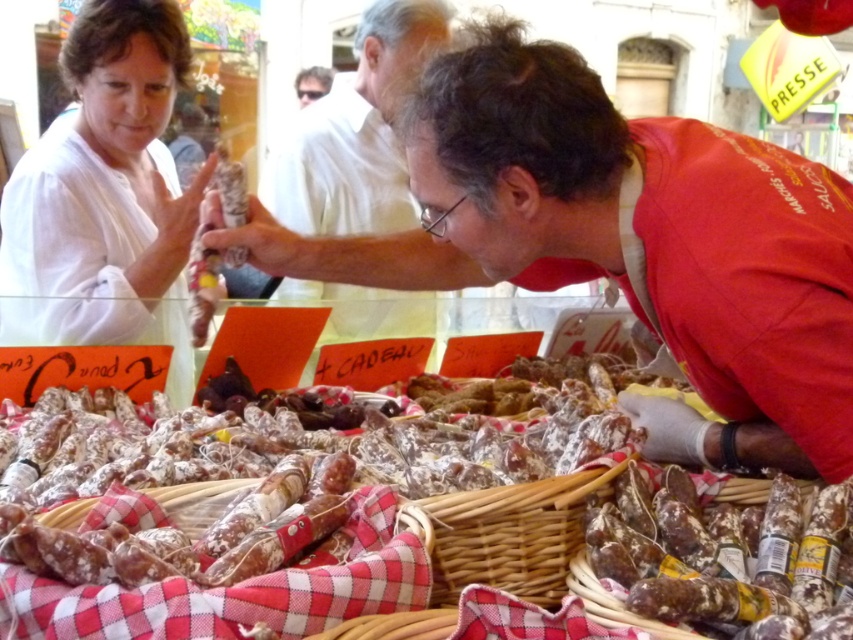
Question: Is the position of matte white sausage at center less distant than that of woven brown basket at center?

Choices:
 (A) yes
 (B) no

Answer: (B)

Question: Which object is farther from the camera taking this photo?

Choices:
 (A) matte white sausage at center
 (B) shiny silver sausage at center

Answer: (A)

Question: Which point is closer to the camera?

Choices:
 (A) (759, 582)
 (B) (320, 276)

Answer: (A)

Question: Which object appears closest to the camera in this image?

Choices:
 (A) matte white sausage at center
 (B) matte white shirt at upper left
 (C) shiny silver sausage at center

Answer: (C)

Question: Is matte white shirt at upper left in front of brown crinkled salami at center?

Choices:
 (A) yes
 (B) no

Answer: (B)

Question: Is matte white sausage at center positioned in front of woven brown basket at center?

Choices:
 (A) no
 (B) yes

Answer: (A)